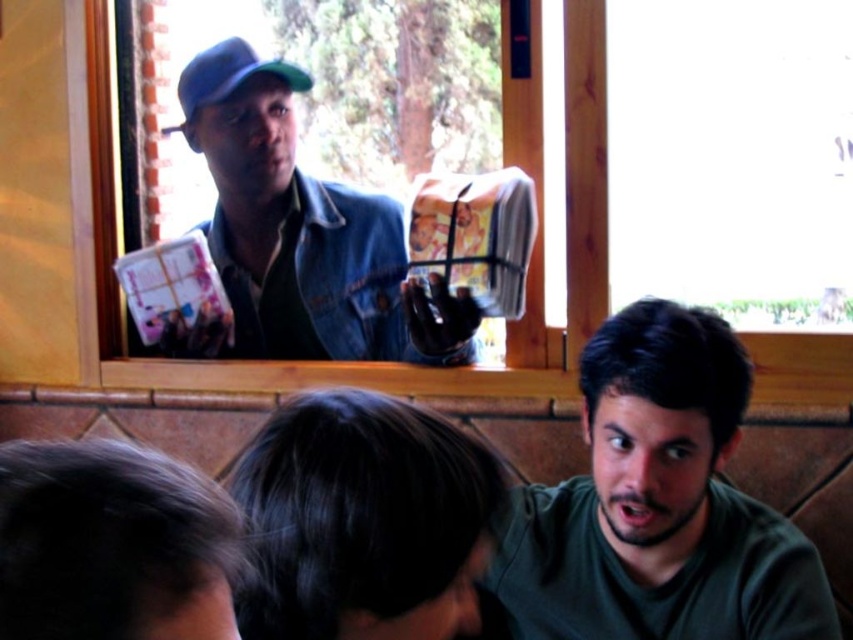
You are a photographer trying to capture a candid shot of the dark brown hair at lower center and the denim jacket at upper center. Based on their positions, which subject is closer to the right edge of the frame?

The dark brown hair at lower center is positioned on the right side of denim jacket at upper center, so the dark brown hair at lower center is closer to the right edge of the frame.

You are a photographer trying to capture both the green matte shirt at lower right and the green matte baseball cap at upper left in a single shot. Which object should you focus on first to ensure both are in frame?

You should focus on the green matte shirt at lower right first because it is larger and will require more attention to frame properly, ensuring the smaller green matte baseball cap at upper left also fits into the shot.

You are a photographer trying to capture a group photo of the people in the scene. You need to ensure that everyone is visible. Given that the green matte shirt at lower right and the denim jacket at upper center are in different positions, which one might require you to adjust your camera angle to include them in the frame?

The denim jacket at upper center is taller than the green matte shirt at lower right, so you might need to adjust the camera angle to include the taller denim jacket at upper center in the frame.